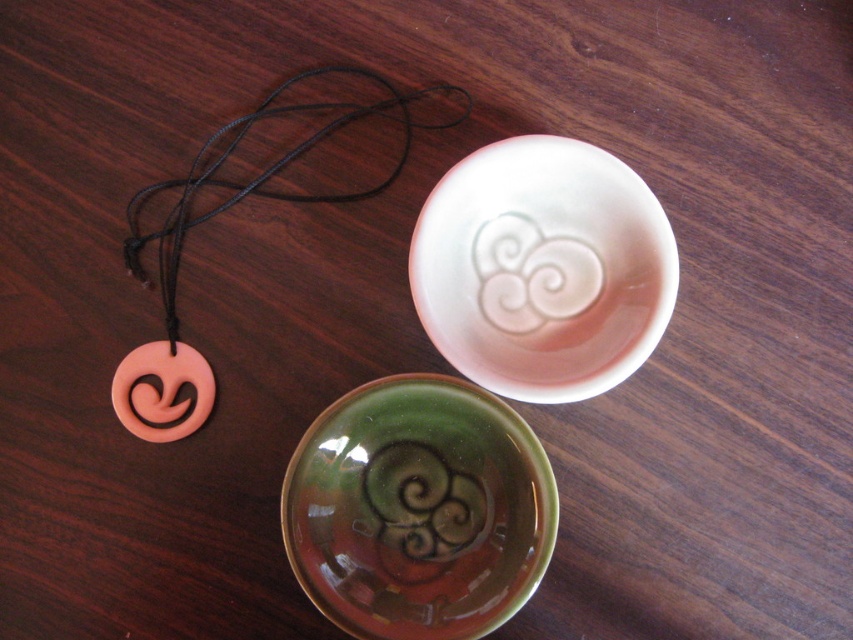
You are an interior designer arranging items on a shelf. You have the white glossy bowl at upper center and the pink matte pendant at upper left. Which item should you place on the lower shelf to ensure stability?

The white glossy bowl at upper center should be placed on the lower shelf because it is shorter than the pink matte pendant at upper left, allowing the taller pendant to be placed above it for stability.

You are a jeweler who needs to place the pink matte pendant at upper left into the white glossy bowl at upper center. Can you fit the pendant into the bowl without it touching the edges?

The white glossy bowl at upper center is 6.29 inches away from the pink matte pendant at upper left. Since the distance between them is greater than the pendant size, the pendant can be placed into the bowl without touching the edges.

You are an interior designer arranging items on a shelf. You have the white glossy bowl at upper center and the pink matte pendant at upper left. If you want to place both items side by side without overlapping, which item should you place on the right side to ensure there is enough space?

The white glossy bowl at upper center has a lesser width compared to the pink matte pendant at upper left, so placing the pink matte pendant at upper left on the right side would allow enough space since it is wider and can be positioned accordingly.